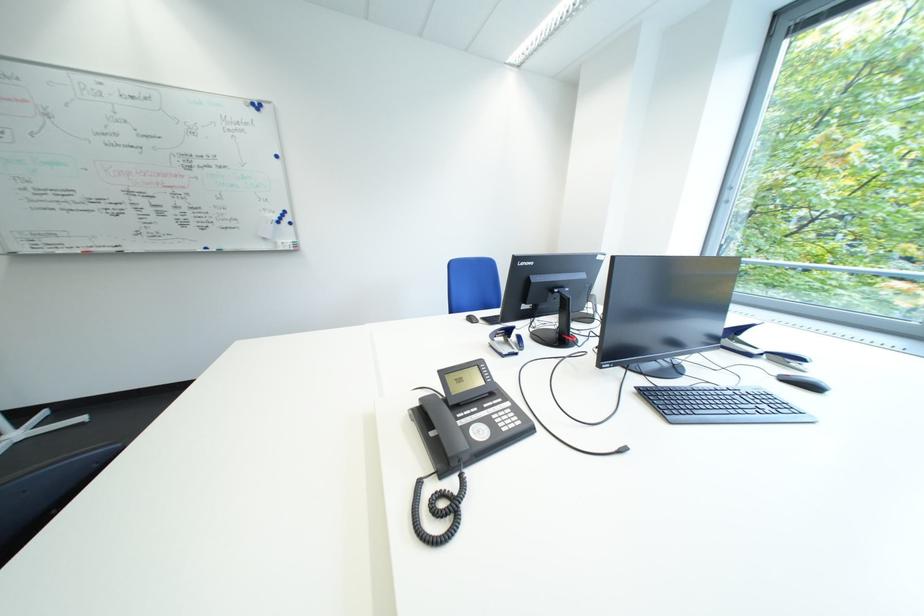
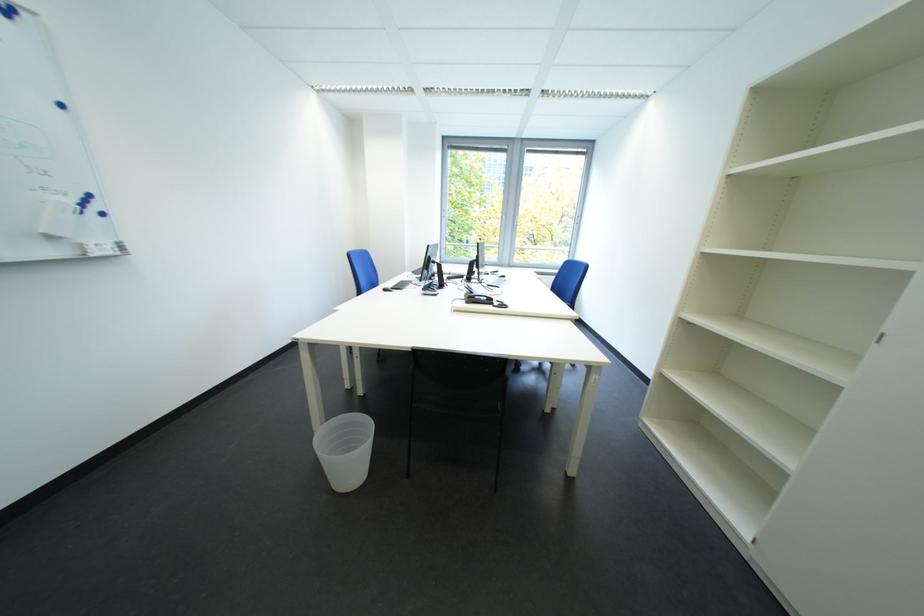
Where in the second image is the point corresponding to pixel 292 244 from the first image?

(101, 245)